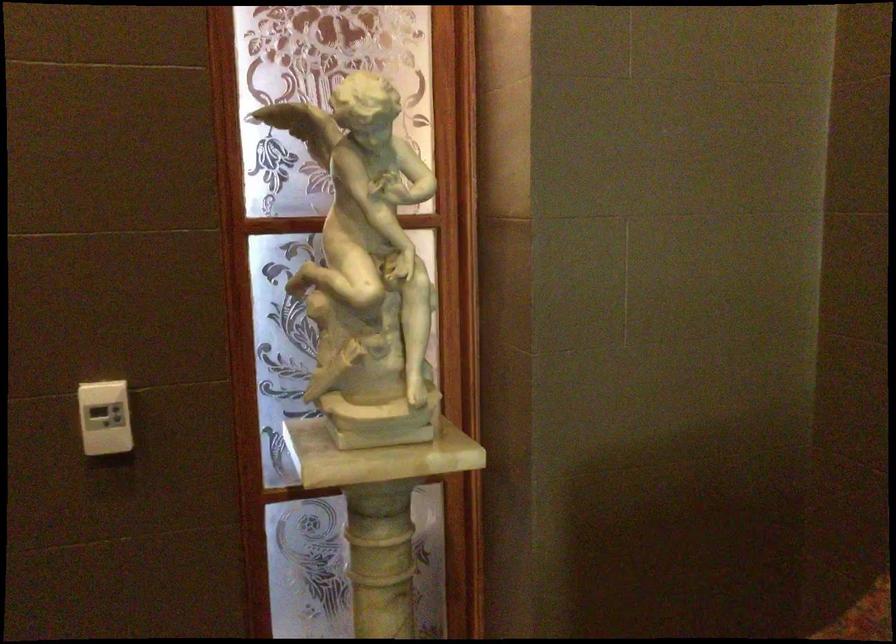
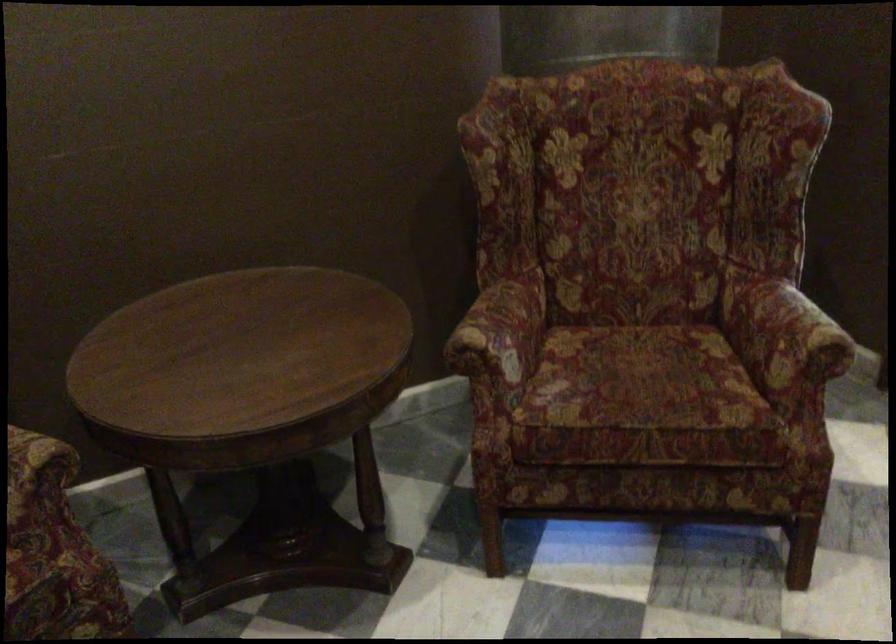
Based on the continuous images, in which direction is the camera rotating?

The camera rotated toward right-down.